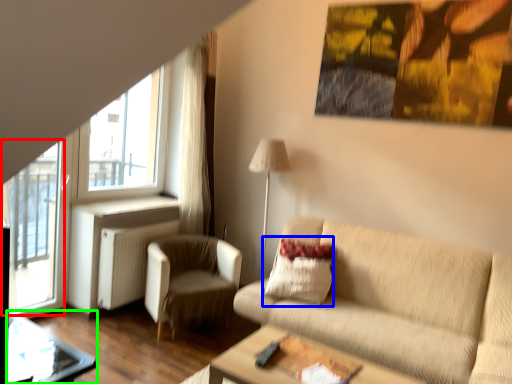
Question: Which is nearer to the screen door (highlighted by a red box)? pillow (highlighted by a blue box) or glass table (highlighted by a green box).

Choices:
 (A) pillow
 (B) glass table

Answer: (B)